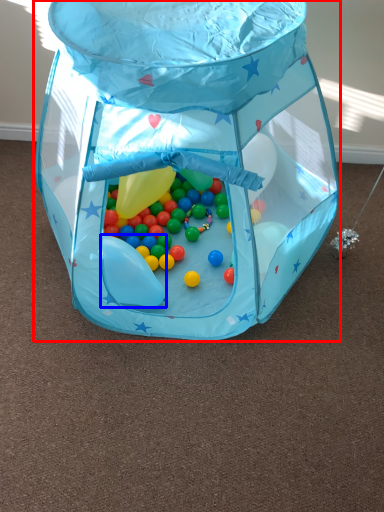
Question: Which object appears closest to the camera in this image, toy (highlighted by a red box) or balloon (highlighted by a blue box)?

Choices:
 (A) toy
 (B) balloon

Answer: (A)